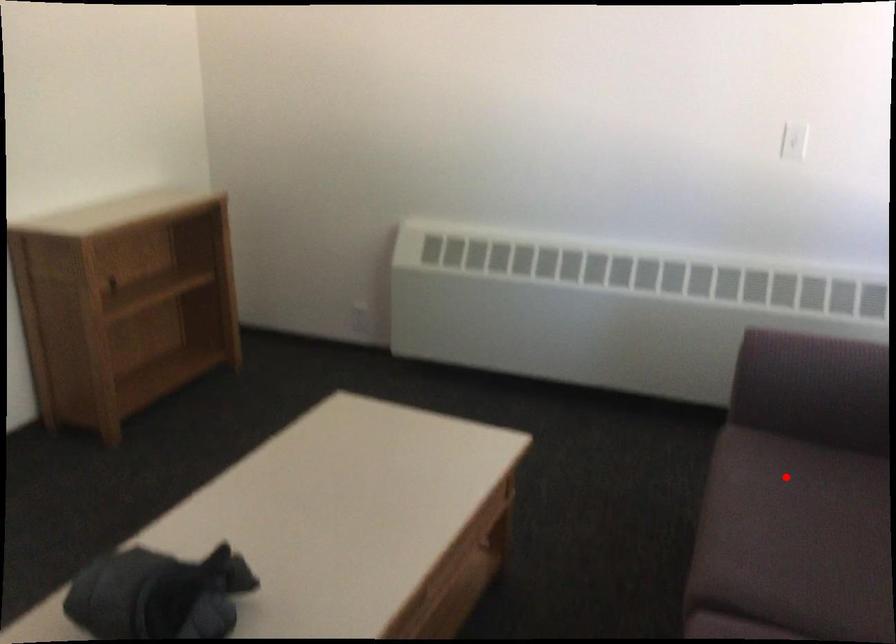
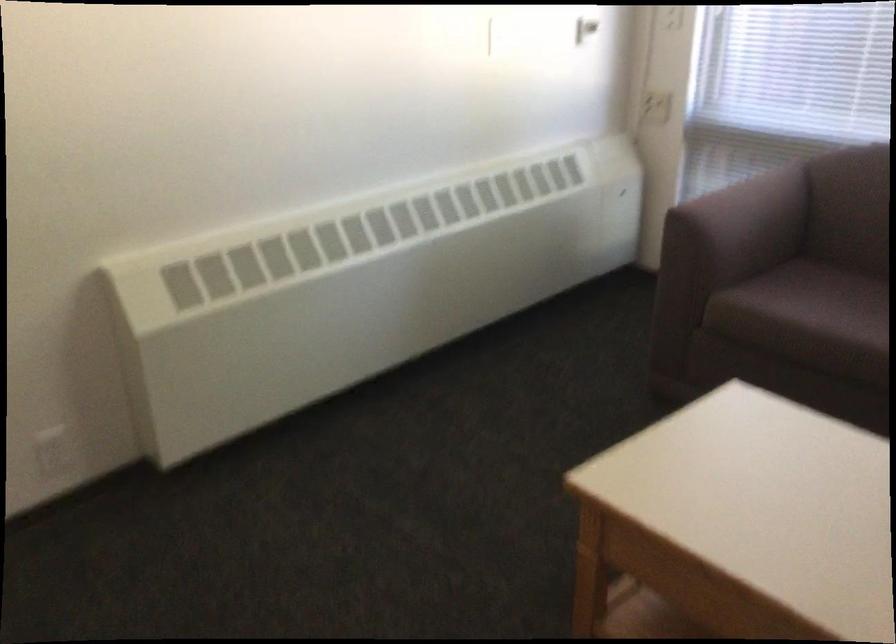
The point at the highlighted location is marked in the first image. Where is the corresponding point in the second image?

(807, 303)